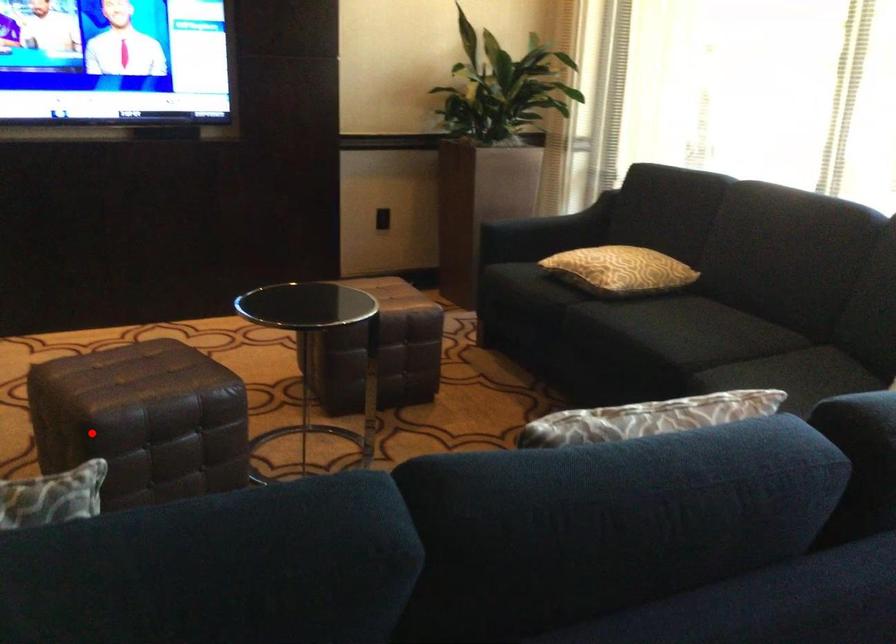
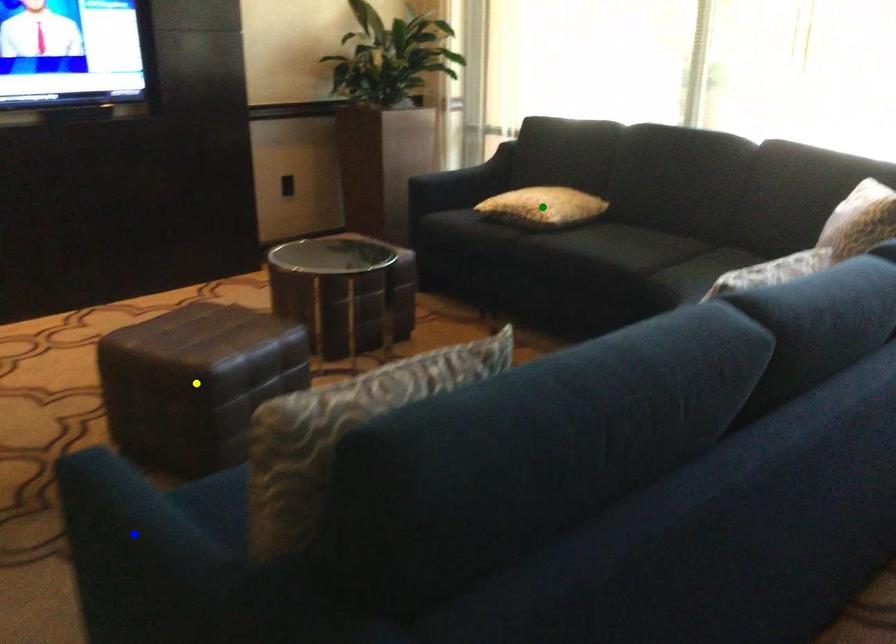
Question: I am providing you with two images of the same scene from different viewpoints. A red point is marked on the first image. You are given multiple points on the second image. Can you choose the point in image 2 that corresponds to the point in image 1?

Choices:
 (A) yellow point
 (B) green point
 (C) blue point

Answer: (A)